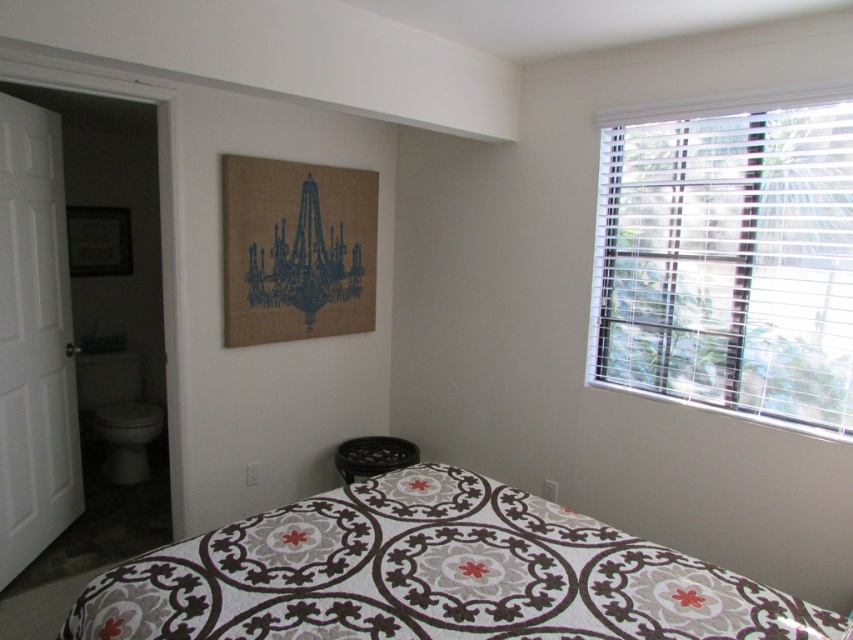
How far apart are patterned fabric bed at center and white blinds at upper right?

They are 3.88 feet apart.

Can you confirm if patterned fabric bed at center is smaller than white blinds at upper right?

Yes.

Is point (428, 580) closer to viewer compared to point (798, 216)?

Yes, it is.

Find the location of `patterned fabric bed at center`. patterned fabric bed at center is located at coordinates (431, 576).